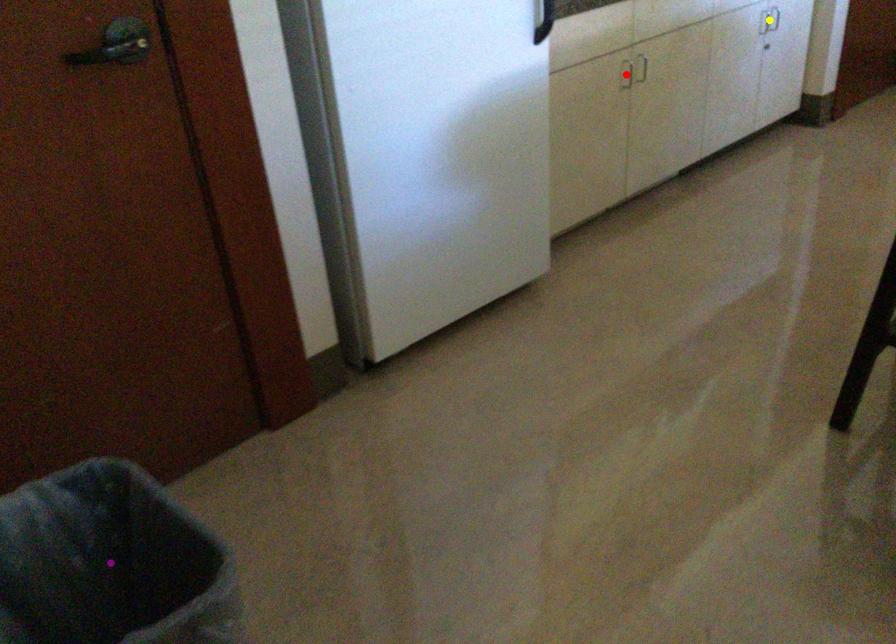
Order these from nearest to farthest:
1. purple point
2. yellow point
3. red point

purple point, red point, yellow point